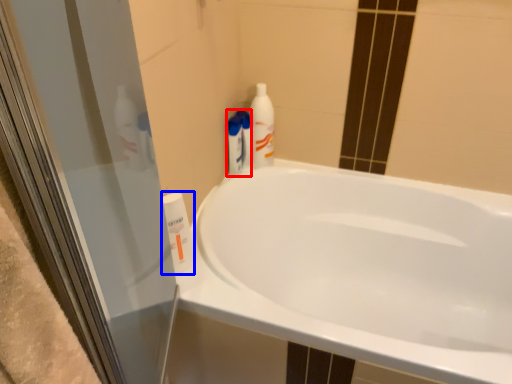
Question: Which object is closer to the camera taking this photo, cleaning product (highlighted by a red box) or cleaning product (highlighted by a blue box)?

Choices:
 (A) cleaning product
 (B) cleaning product

Answer: (B)